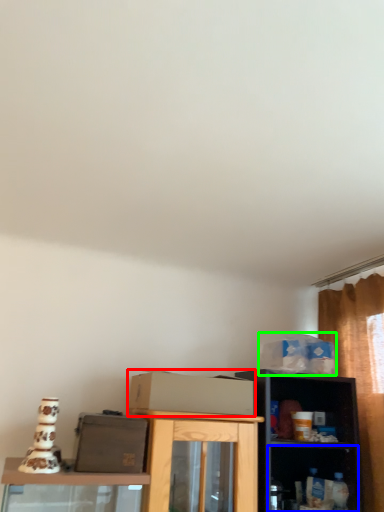
Question: Based on their relative distances, which object is nearer to cardboard box (highlighted by a red box)? Choose from shelf (highlighted by a blue box) and box (highlighted by a green box).

Choices:
 (A) shelf
 (B) box

Answer: (B)